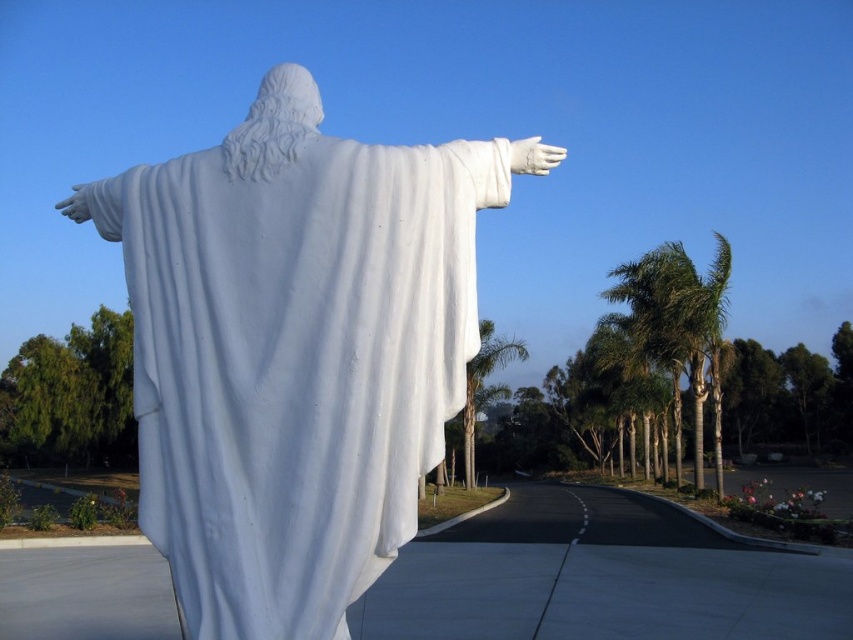
In the scene shown: You are a visitor standing in front of the white marble statue at center and the green leafy palm tree at center. Which object is taller?

The green leafy palm tree at center is taller than the white marble statue at center.

You are standing in front of the statue facing the same direction as the statue. You want to know which of the palm trees, the green leafy palm trees at right or the green leafy palm tree at center, is taller. Which one is taller?

The green leafy palm trees at right is taller than the green leafy palm tree at center.

You are standing at the point marked by the coordinates point (329, 566) and want to take a photo of the statue. Since the statue is facing away from you, can you move closer to get a better frontal view?

The point (329, 566) is 10.73 feet away from the viewer. Moving closer would reduce the distance, allowing for a better frontal view of the statue.